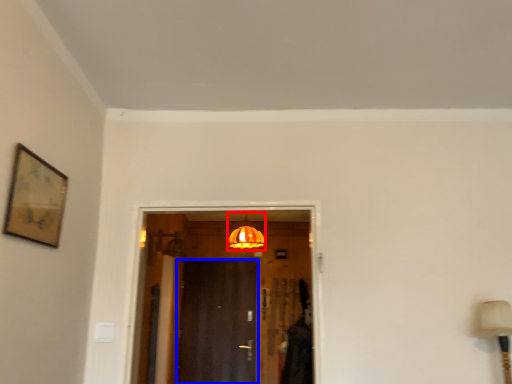
Question: Among these objects, which one is nearest to the camera, light fixture (highlighted by a red box) or door (highlighted by a blue box)?

Choices:
 (A) light fixture
 (B) door

Answer: (A)